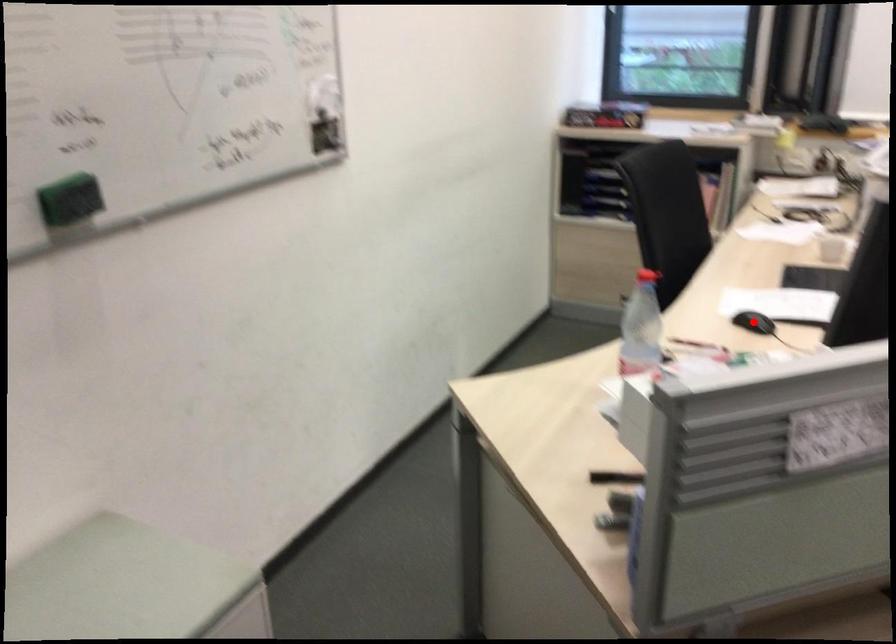
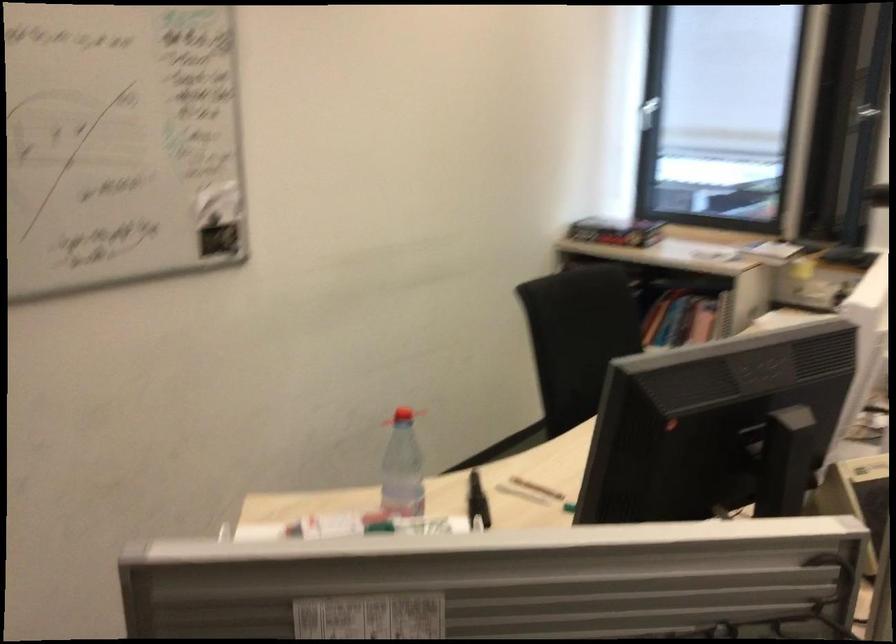
Question: I am providing you with two images of the same scene from different viewpoints. A red point is marked on the first image. At the location where the point appears in image 1, is it still visible in image 2?

Choices:
 (A) Yes
 (B) No

Answer: (B)